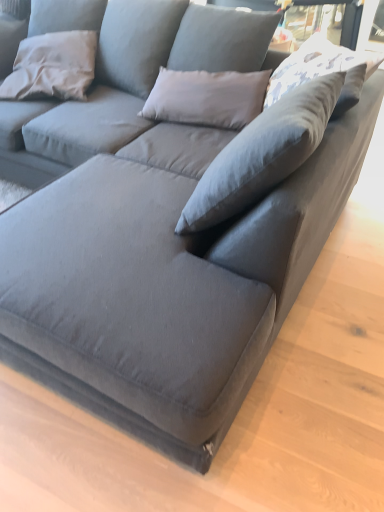
Question: Looking at their shapes, would you say gray fabric pillow at upper left, placed as the first pillow when sorted from left to right, is wider or thinner than white printed fabric pillow at upper right, which is the first pillow in front-to-back order?

Choices:
 (A) wide
 (B) thin

Answer: (B)

Question: From a real-world perspective, is gray fabric pillow at upper left, which is the second pillow in right-to-left order, physically located above or below white printed fabric pillow at upper right, the second pillow viewed from the left?

Choices:
 (A) below
 (B) above

Answer: (A)

Question: Considering the positions of gray fabric pillow at upper left, which appears as the 2th pillow when viewed from the front, and white printed fabric pillow at upper right, the second pillow viewed from the left, in the image, is gray fabric pillow at upper left, which appears as the 2th pillow when viewed from the front, bigger or smaller than white printed fabric pillow at upper right, the second pillow viewed from the left,?

Choices:
 (A) big
 (B) small

Answer: (A)

Question: Looking at the image, does white printed fabric pillow at upper right, which is the first pillow in right-to-left order, seem bigger or smaller compared to gray fabric pillow at upper left, placed as the first pillow when sorted from left to right?

Choices:
 (A) small
 (B) big

Answer: (A)

Question: Considering their positions, is white printed fabric pillow at upper right, the second pillow viewed from the left, located in front of or behind gray fabric pillow at upper left, the first pillow from the back?

Choices:
 (A) front
 (B) behind

Answer: (A)

Question: In terms of width, does white printed fabric pillow at upper right, which is the first pillow in front-to-back order, look wider or thinner when compared to gray fabric pillow at upper left, the first pillow from the back?

Choices:
 (A) wide
 (B) thin

Answer: (A)

Question: Considering the positions of point (297, 84) and point (16, 84), is point (297, 84) closer or farther from the camera than point (16, 84)?

Choices:
 (A) farther
 (B) closer

Answer: (B)